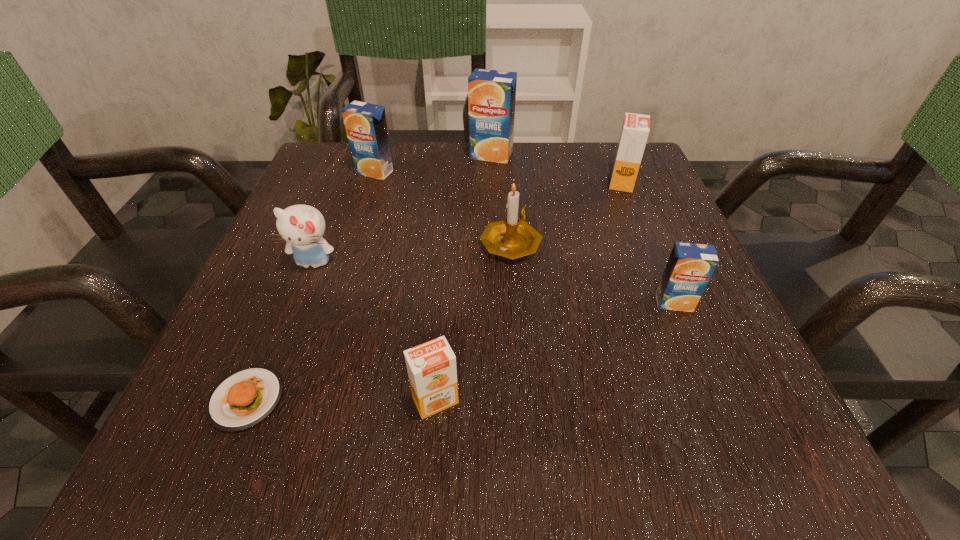
Find the location of `vacant position located on the back of the shortest object`. vacant position located on the back of the shortest object is located at coordinates [x=324, y=212].

I want to click on orange juice that is at the near edge, so click(x=431, y=366).

The image size is (960, 540). I want to click on food located at the near edge, so click(x=246, y=397).

At what (x,y) coordinates should I click in order to perform the action: click on orange_juice located in the left edge section of the desktop. Please return your answer as a coordinate pair (x, y). This screenshot has height=540, width=960. Looking at the image, I should click on (366, 127).

Locate an element on the screen. kitten that is at the left edge is located at coordinates (302, 226).

In order to click on food present at the left edge in this screenshot , I will do `click(246, 397)`.

Identify the location of object at the far left corner. (366, 127).

What are the coordinates of `object at the near left corner` in the screenshot? It's located at (246, 397).

Find the location of a particular element. This screenshot has height=540, width=960. object located at the far right corner is located at coordinates (635, 129).

The image size is (960, 540). In order to click on vacant space at the far edge of the desktop in this screenshot , I will do `click(564, 156)`.